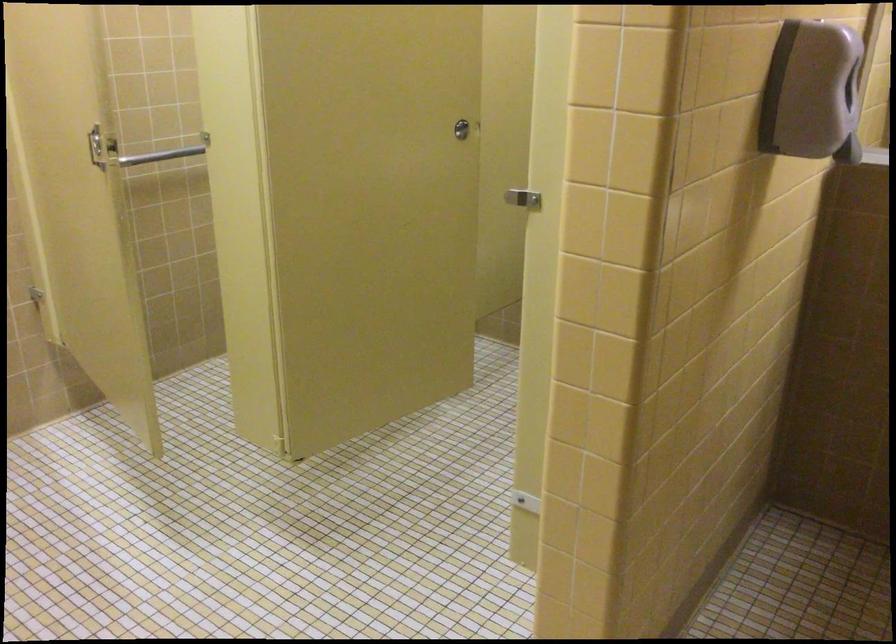
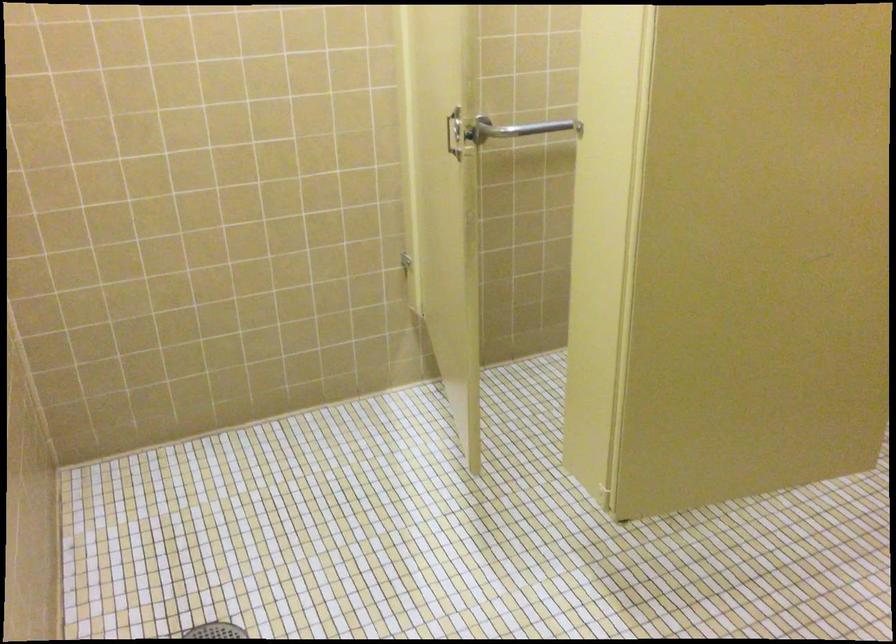
Question: The images are taken continuously from a first-person perspective. In which direction is your viewpoint rotating?

Choices:
 (A) Left
 (B) Right
 (C) Up
 (D) Down

Answer: (A)